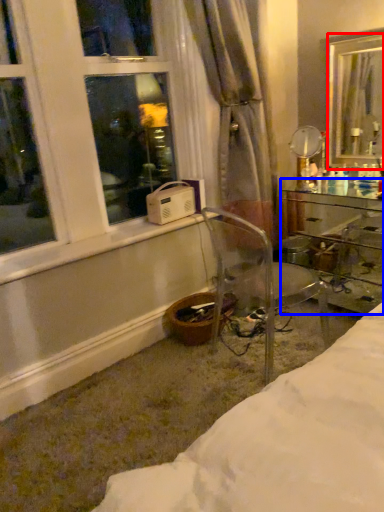
Question: Which object is further to the camera taking this photo, mirror (highlighted by a red box) or desk (highlighted by a blue box)?

Choices:
 (A) mirror
 (B) desk

Answer: (A)